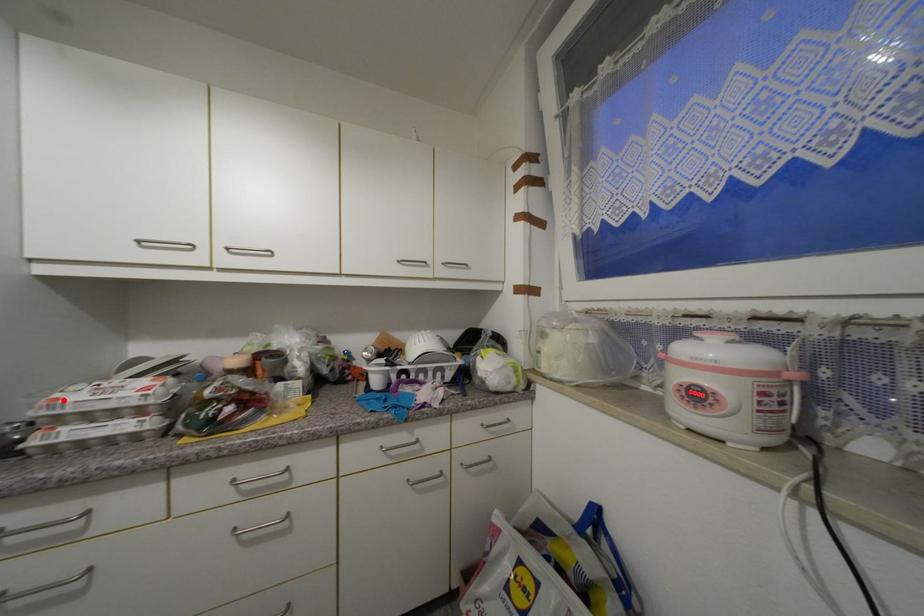
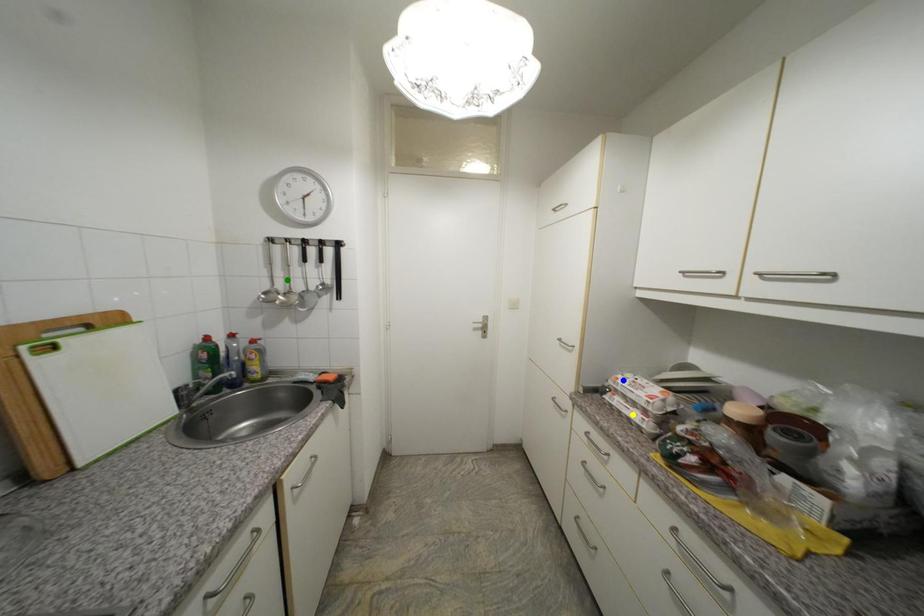
Question: I am providing you with two images of the same scene from different viewpoints. A red point is marked on the first image. You are given multiple points on the second image. Which spot in image 2 lines up with the point in image 1?

Choices:
 (A) blue point
 (B) yellow point
 (C) green point

Answer: (A)